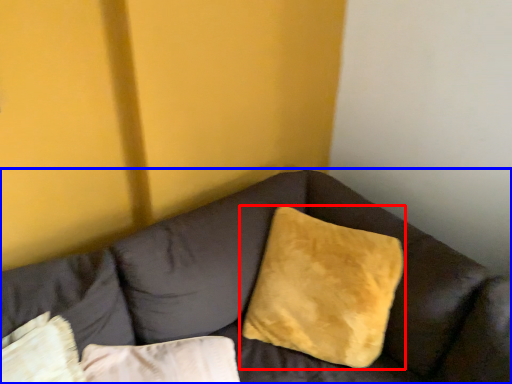
Question: Which point is further to the camera, pillow (highlighted by a red box) or studio couch (highlighted by a blue box)?

Choices:
 (A) pillow
 (B) studio couch

Answer: (A)